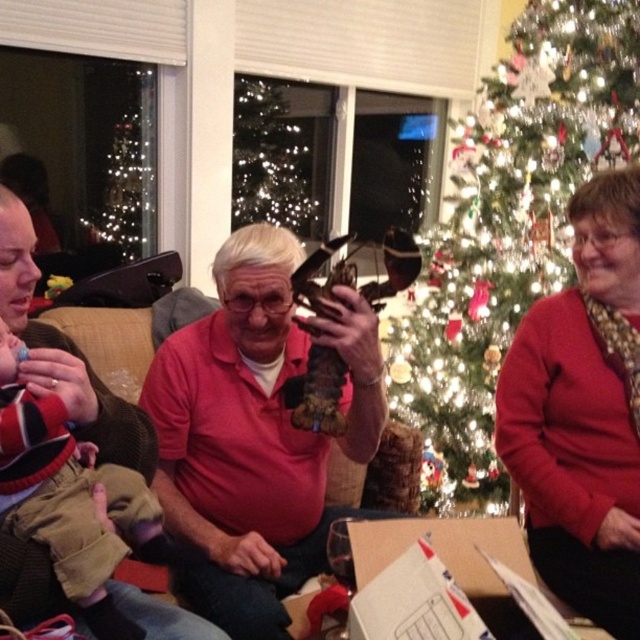
Can you confirm if matte pink shirt at center is smaller than red sweater at right?

No.

Does matte pink shirt at center lie behind red sweater at right?

Yes, it is behind red sweater at right.

Describe the element at coordinates (256, 433) in the screenshot. The height and width of the screenshot is (640, 640). I see `matte pink shirt at center` at that location.

Identify the location of matte pink shirt at center. (256, 433).

Is iridescent glass ornaments at center smaller than matte pink shirt at center?

Actually, iridescent glass ornaments at center might be larger than matte pink shirt at center.

Is point (611, 156) farther from viewer compared to point (216, 348)?

Yes, point (611, 156) is behind point (216, 348).

Locate an element on the screen. The height and width of the screenshot is (640, 640). iridescent glass ornaments at center is located at coordinates (512, 220).

Can you confirm if iridescent glass ornaments at center is positioned to the left of red sweater at right?

In fact, iridescent glass ornaments at center is to the right of red sweater at right.

Between point (600, 19) and point (508, 365), which one is positioned behind?

The point (600, 19) is more distant.

Find the location of a particular element. iridescent glass ornaments at center is located at coordinates (512, 220).